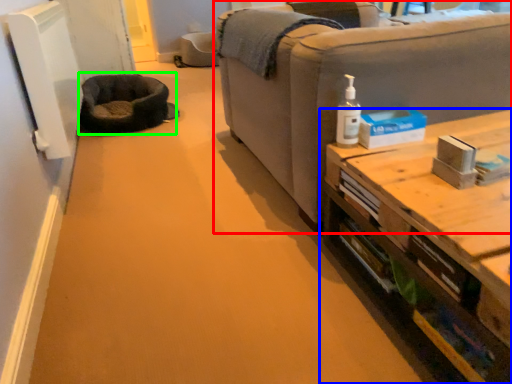
Question: Which object is the closest to the studio couch (highlighted by a red box)? Choose among these: table (highlighted by a blue box) or cat bed (highlighted by a green box).

Choices:
 (A) table
 (B) cat bed

Answer: (A)